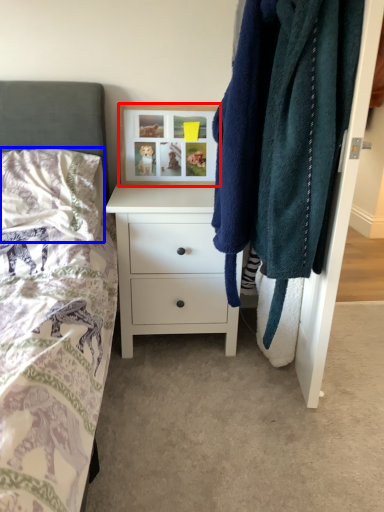
Question: Which object appears closest to the camera in this image, picture frame (highlighted by a red box) or pillow (highlighted by a blue box)?

Choices:
 (A) picture frame
 (B) pillow

Answer: (B)